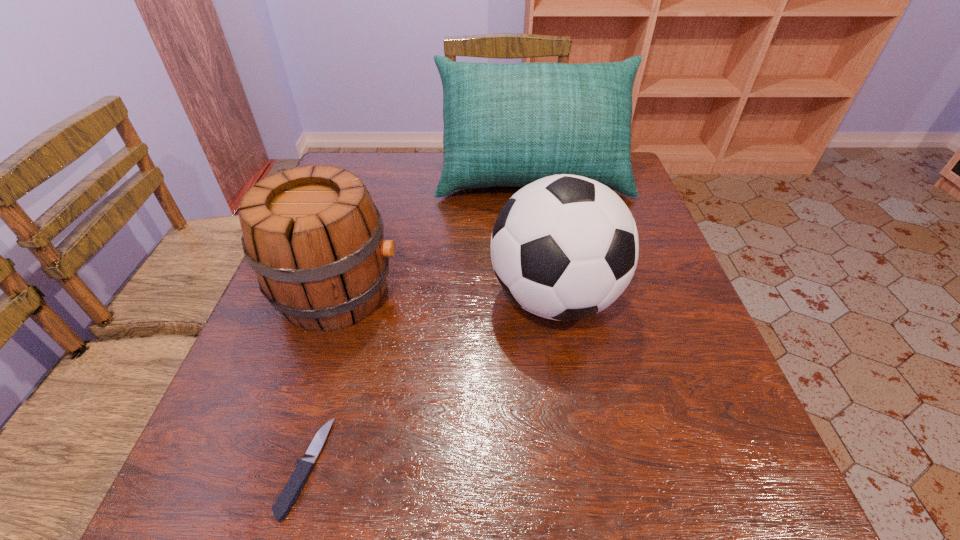
Where is `cushion`? This screenshot has width=960, height=540. cushion is located at coordinates (509, 125).

Image resolution: width=960 pixels, height=540 pixels. In order to click on soccer ball in this screenshot , I will do `click(564, 247)`.

Where is `cider`? The height and width of the screenshot is (540, 960). cider is located at coordinates (313, 236).

At what (x,y) coordinates should I click in order to perform the action: click on the shortest object. Please return your answer as a coordinate pair (x, y). This screenshot has height=540, width=960. Looking at the image, I should click on (293, 488).

Identify the location of steak knife. The height and width of the screenshot is (540, 960). (293, 488).

I want to click on vacant space located on the front-facing side of the cushion, so click(542, 240).

The height and width of the screenshot is (540, 960). I want to click on vacant space situated 0.320m on the back of the soccer ball, so click(x=535, y=180).

You are a GUI agent. You are given a task and a screenshot of the screen. Output one action in this format:
    pyautogui.click(x=<x>, y=<y>)
    Task: Click on the vacant space situated on the side of the cider where the spigot is located
    
    Given the screenshot: What is the action you would take?
    pyautogui.click(x=482, y=293)

The width and height of the screenshot is (960, 540). What are the coordinates of `free location located on the right of the shortest object` in the screenshot? It's located at (543, 467).

Identify the location of object at the far edge. The width and height of the screenshot is (960, 540). (509, 125).